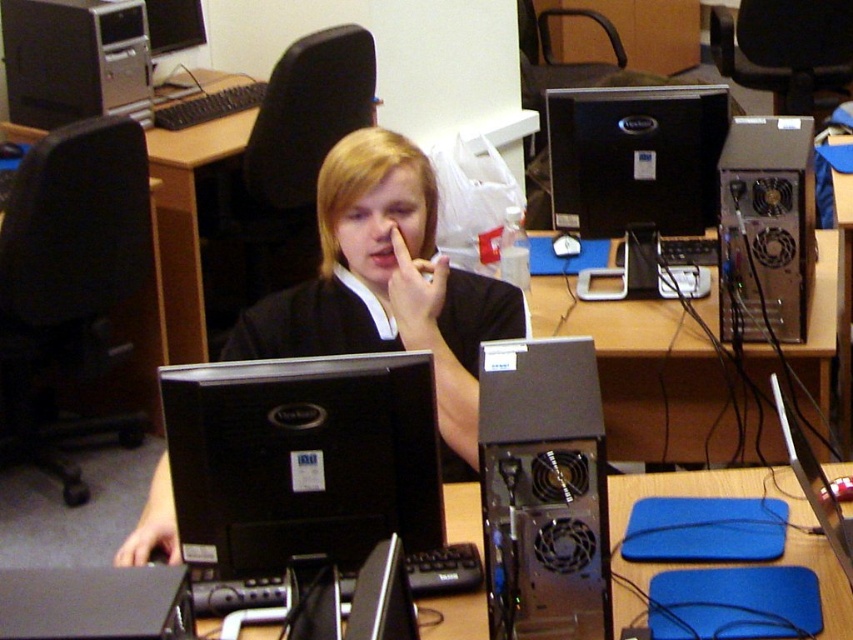
Question: Which object appears farthest from the camera in this image?

Choices:
 (A) metallic silver computer case at center-right
 (B) matte black monitor at center
 (C) silver metallic laptop at center

Answer: (A)

Question: Which point is farther to the camera?

Choices:
 (A) (549, 490)
 (B) (338, 234)
 (C) (775, 225)
 (D) (762, 378)

Answer: (D)

Question: Where is black plastic computer tower at center located in relation to metallic silver computer case at center-right in the image?

Choices:
 (A) below
 (B) above

Answer: (A)

Question: Which object appears farthest from the camera in this image?

Choices:
 (A) metallic silver computer case at center-right
 (B) matte black monitor at center
 (C) black plastic monitor at center

Answer: (A)

Question: Is matte black monitor at center thinner than silver metallic laptop at center?

Choices:
 (A) yes
 (B) no

Answer: (B)

Question: Is black plastic computer tower at center closer to camera compared to silver metallic desktop at upper left?

Choices:
 (A) yes
 (B) no

Answer: (A)